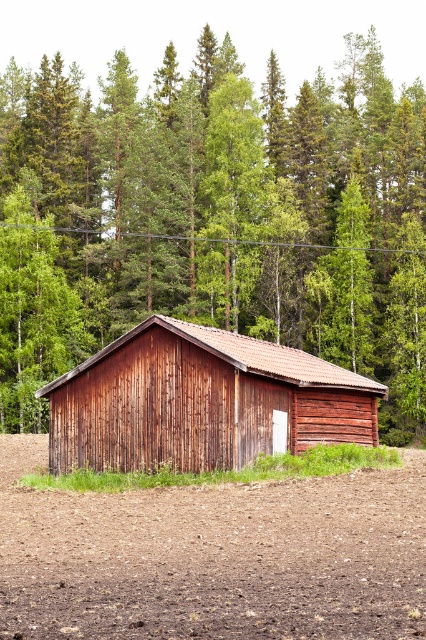
You are standing in front of the rustic wooden barn and notice two points marked on the ground. One is labeled as point (368,324) and the other as point (368,612). Which point is closer to the barn?

Point (368,324) is behind point (368,612), so point (368,612) is closer to the barn.

You are standing at the origin point in a rural area and want to locate the brown wooden house at center. According to the coordinates provided, in which direction should you move to reach it?

The brown wooden house at center is located at coordinates approximately 0.339 on the x axis and 0.502 on the y axis. Since you are at the origin point, you should move northeast to reach it.